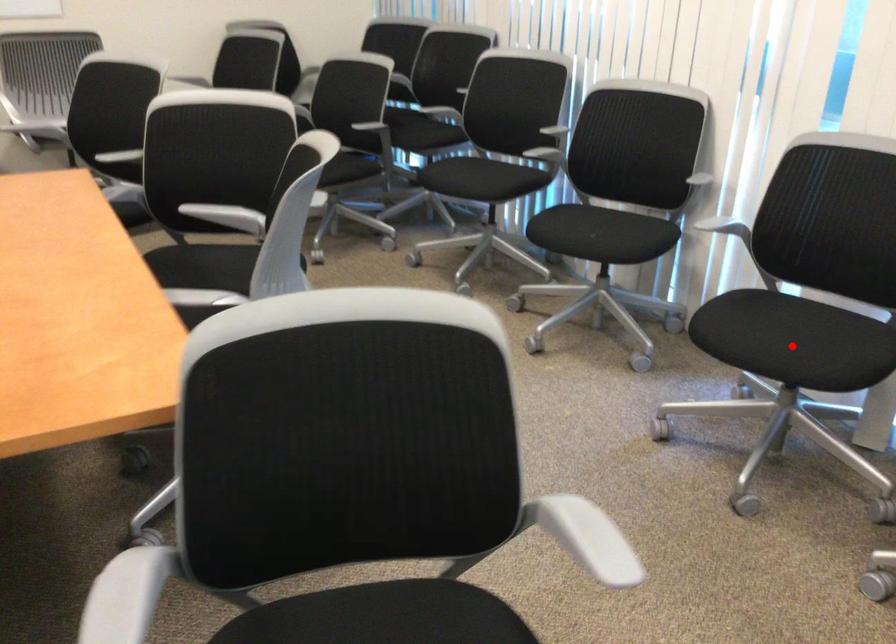
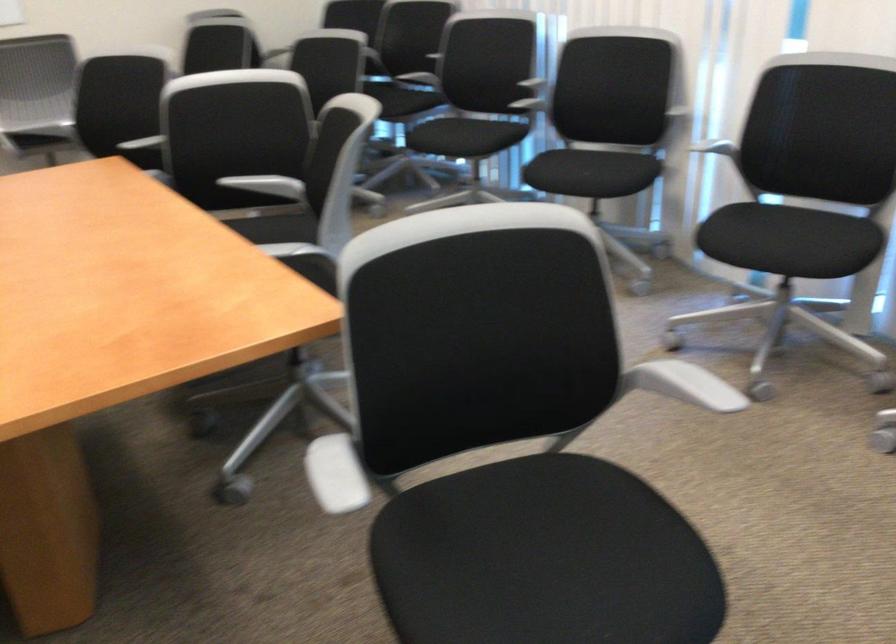
The point at the highlighted location is marked in the first image. Where is the corresponding point in the second image?

(789, 240)